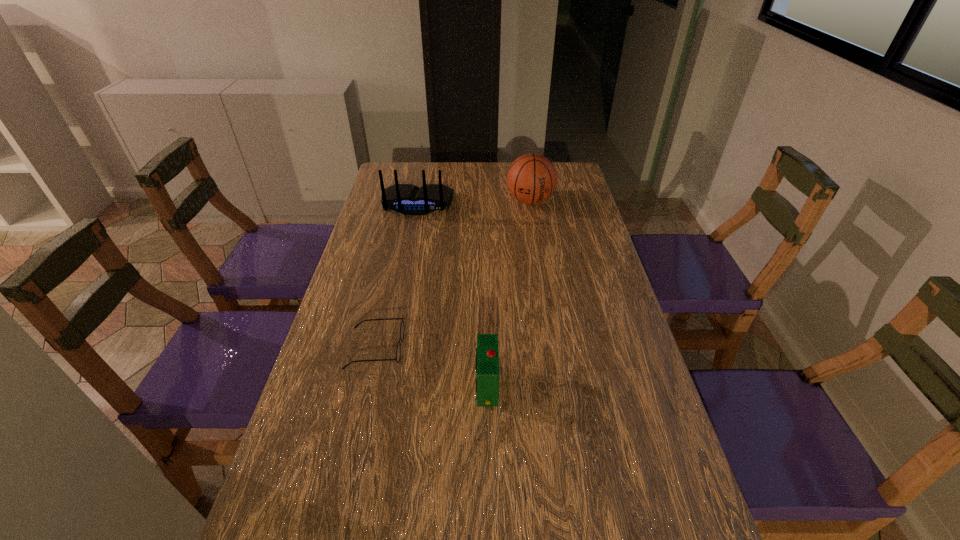
This screenshot has width=960, height=540. In order to click on free location located on the front-facing side of the shortest object in this screenshot , I will do `click(505, 348)`.

You are a GUI agent. You are given a task and a screenshot of the screen. Output one action in this format:
    pyautogui.click(x=<x>, y=<y>)
    Task: Click on the object that is at the far edge
    
    Given the screenshot: What is the action you would take?
    pyautogui.click(x=532, y=178)

Locate an element on the screen. router that is at the left edge is located at coordinates (407, 199).

I want to click on spectacles situated at the left edge, so click(x=398, y=351).

The width and height of the screenshot is (960, 540). Find the location of `object present at the right edge`. object present at the right edge is located at coordinates (532, 178).

You are a GUI agent. You are given a task and a screenshot of the screen. Output one action in this format:
    pyautogui.click(x=<x>, y=<y>)
    Task: Click on the object situated at the far right corner
    
    Given the screenshot: What is the action you would take?
    pyautogui.click(x=532, y=178)

The width and height of the screenshot is (960, 540). Find the location of `free location at the far edge of the desktop`. free location at the far edge of the desktop is located at coordinates tap(492, 183).

Image resolution: width=960 pixels, height=540 pixels. I want to click on vacant space at the left edge of the desktop, so click(x=271, y=537).

Image resolution: width=960 pixels, height=540 pixels. Identify the location of free space at the right edge of the desktop. (586, 339).

The image size is (960, 540). Identify the location of free space at the far left corner. (379, 182).